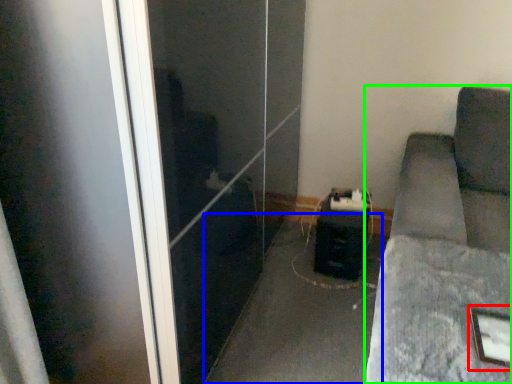
Question: Estimate the real-world distances between objects in this image. Which object is farther from picture frame (highlighted by a red box), concrete (highlighted by a blue box) or furniture (highlighted by a green box)?

Choices:
 (A) concrete
 (B) furniture

Answer: (A)